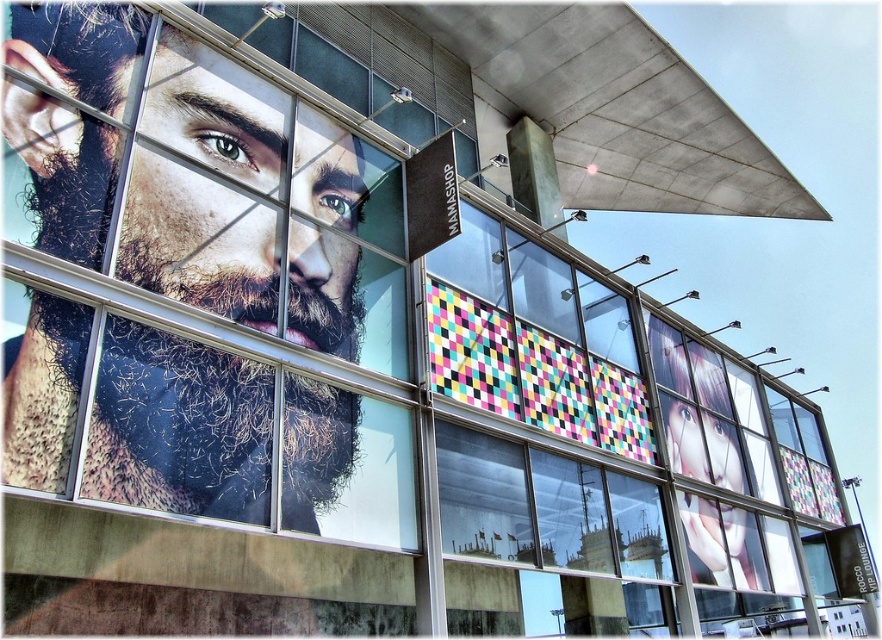
Question: Does realistic skin portrait at upper left appear under multicolored mosaic tiles at center?

Choices:
 (A) no
 (B) yes

Answer: (A)

Question: Is beige textured beard at left bigger than realistic skin portrait at upper left?

Choices:
 (A) no
 (B) yes

Answer: (B)

Question: Which point is closer to the camera?

Choices:
 (A) realistic skin portrait at upper left
 (B) beige textured beard at left
 (C) multicolored mosaic tiles at center

Answer: (B)

Question: Where is realistic skin portrait at upper left located in relation to multicolored mosaic tiles at center in the image?

Choices:
 (A) left
 (B) right

Answer: (A)

Question: Which object is farther from the camera taking this photo?

Choices:
 (A) beige textured beard at left
 (B) multicolored mosaic tiles at center

Answer: (B)

Question: Among these points, which one is nearest to the camera?

Choices:
 (A) (x=527, y=412)
 (B) (x=275, y=125)

Answer: (B)